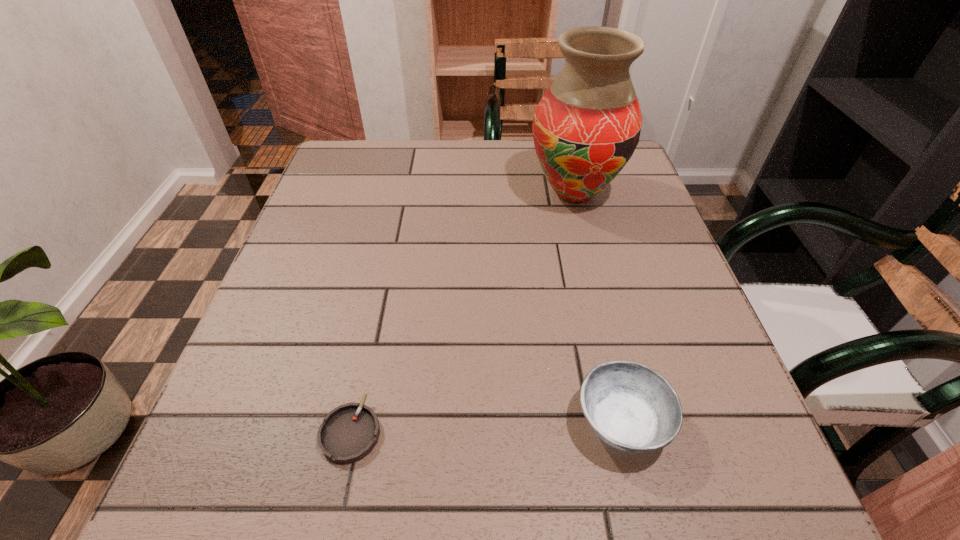
In order to click on blank area at the near right corner in this screenshot , I will do `click(699, 479)`.

You are a GUI agent. You are given a task and a screenshot of the screen. Output one action in this format:
    pyautogui.click(x=<x>, y=<y>)
    Task: Click on the vacant region between the tallest object and the shortest object
    The height and width of the screenshot is (540, 960).
    Given the screenshot: What is the action you would take?
    pyautogui.click(x=463, y=312)

You are a GUI agent. You are given a task and a screenshot of the screen. Output one action in this format:
    pyautogui.click(x=<x>, y=<y>)
    Task: Click on the free spot between the right ashtray and the leftmost object
    This screenshot has height=540, width=960.
    Given the screenshot: What is the action you would take?
    pyautogui.click(x=486, y=427)

At what (x,y) coordinates should I click in order to perform the action: click on empty space that is in between the shorter ashtray and the farthest object. Please return your answer as a coordinate pair (x, y). This screenshot has width=960, height=540. Looking at the image, I should click on (463, 312).

Locate an element on the screen. free space between the second tallest object and the vase is located at coordinates (597, 308).

This screenshot has height=540, width=960. Identify the location of vacant point located between the shortest object and the farthest object. (463, 312).

Find the location of a particular element. The width and height of the screenshot is (960, 540). unoccupied area between the vase and the taller ashtray is located at coordinates (597, 308).

The width and height of the screenshot is (960, 540). In order to click on empty space that is in between the second shortest object and the farthest object in this screenshot , I will do `click(597, 308)`.

At what (x,y) coordinates should I click in order to perform the action: click on free point between the shorter ashtray and the second shortest object. Please return your answer as a coordinate pair (x, y). The image size is (960, 540). Looking at the image, I should click on (486, 427).

At what (x,y) coordinates should I click in order to perform the action: click on free space between the tallest object and the leftmost object. Please return your answer as a coordinate pair (x, y). This screenshot has width=960, height=540. Looking at the image, I should click on (463, 312).